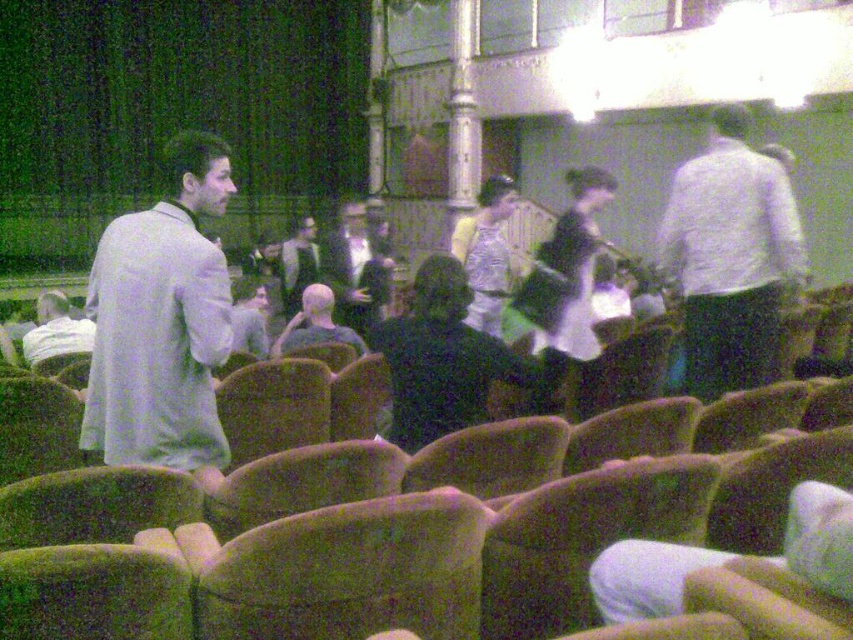
You are an event organizer who needs to arrange seating for two guests wearing the matte black jacket at center and the dark gray suit at center. If the seats are only 1.2 meters wide, can both guests sit side by side without overlapping?

The matte black jacket at center might be wider than dark gray suit at center, so it is uncertain if both can fit within the 1.2 meters. It would depend on the exact widths of their garments.